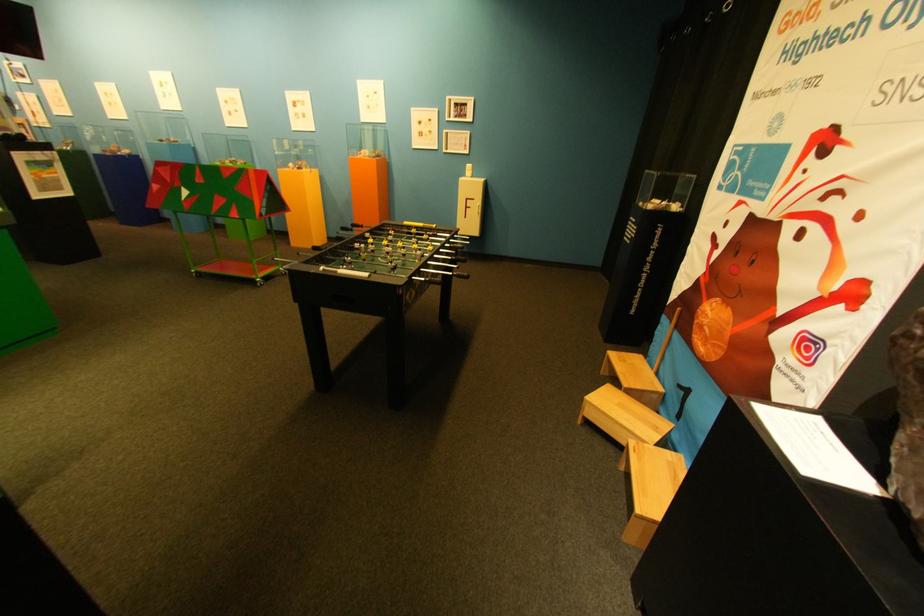
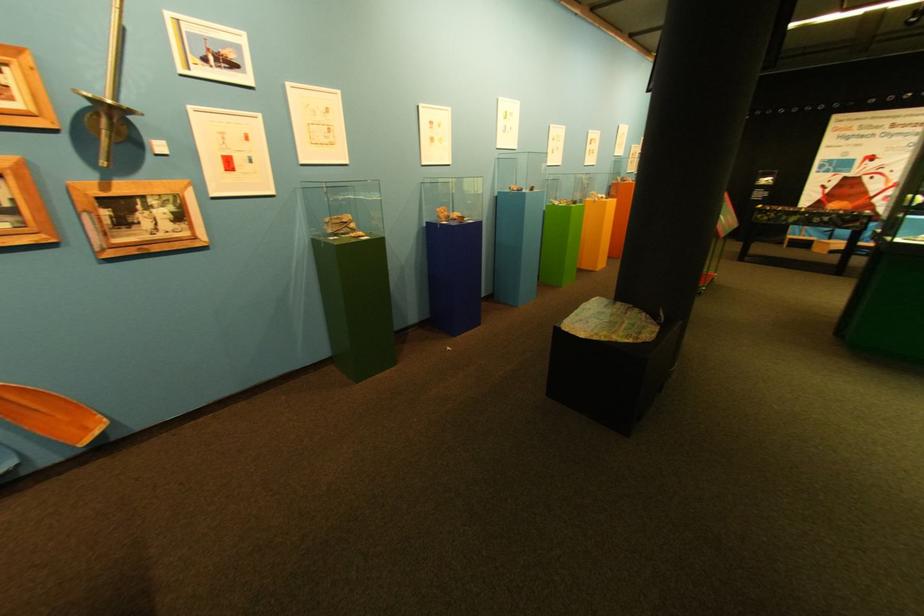
In the second image, find the point that corresponds to (122,95) in the first image.

(445, 124)